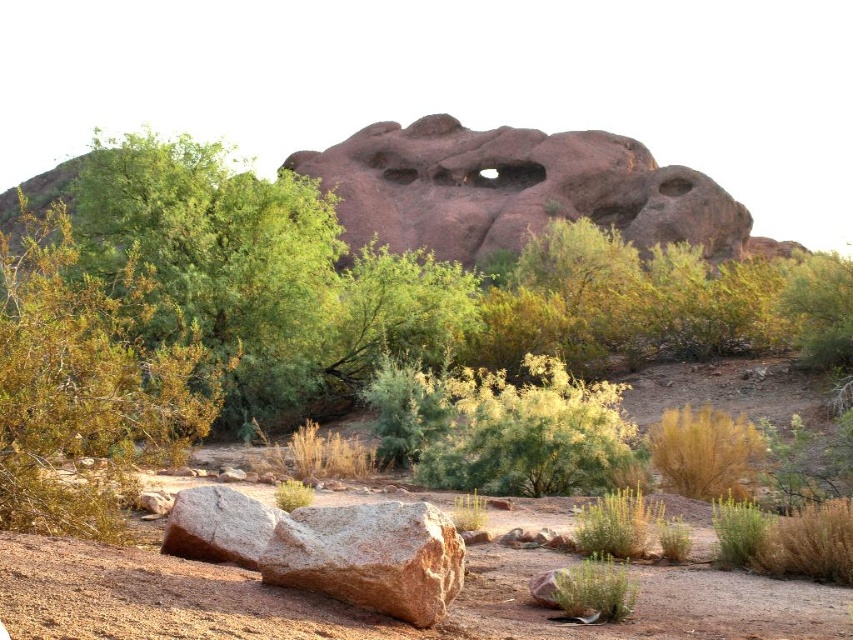
Question: Is green leafy bush at left positioned before brown rough boulder at lower left?

Choices:
 (A) yes
 (B) no

Answer: (B)

Question: Which point appears closest to the camera in this image?

Choices:
 (A) (260, 541)
 (B) (503, 163)
 (C) (325, 529)

Answer: (C)

Question: Which object appears closest to the camera in this image?

Choices:
 (A) rusty brown rock at center
 (B) brown rough boulder at lower left
 (C) rusty granite boulder at lower left
 (D) green leafy bush at left

Answer: (B)

Question: Is green leafy bush at left closer to camera compared to rusty brown rock at center?

Choices:
 (A) no
 (B) yes

Answer: (B)

Question: Observing the image, what is the correct spatial positioning of green leafy bush at left in reference to brown rough boulder at lower left?

Choices:
 (A) right
 (B) left

Answer: (B)

Question: Which of the following is the closest to the observer?

Choices:
 (A) brown rough boulder at lower left
 (B) rusty granite boulder at lower left
 (C) green leafy bush at left
 (D) rusty brown rock at center

Answer: (A)